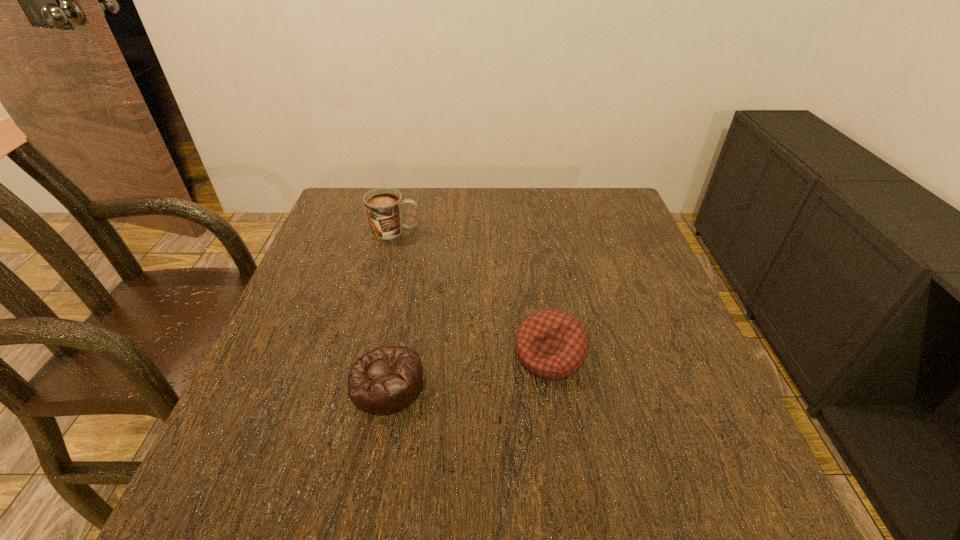
You are a GUI agent. You are given a task and a screenshot of the screen. Output one action in this format:
    pyautogui.click(x=<x>, y=<y>)
    Task: Click on the blank space that satisfies the following two spatial constraints: 1. on the back side of the second shortest object; 2. on the left side of the shortest object
    Image resolution: width=960 pixels, height=540 pixels.
    Given the screenshot: What is the action you would take?
    pyautogui.click(x=393, y=355)

Image resolution: width=960 pixels, height=540 pixels. What are the coordinates of `free space that satisfies the following two spatial constraints: 1. on the side of the farthest object with the handle; 2. on the right side of the rightmost object` in the screenshot? It's located at (366, 355).

Identify the location of free point that satisfies the following two spatial constraints: 1. on the back side of the shorter beanbag; 2. on the side of the farthest object with the handle. Image resolution: width=960 pixels, height=540 pixels. (416, 231).